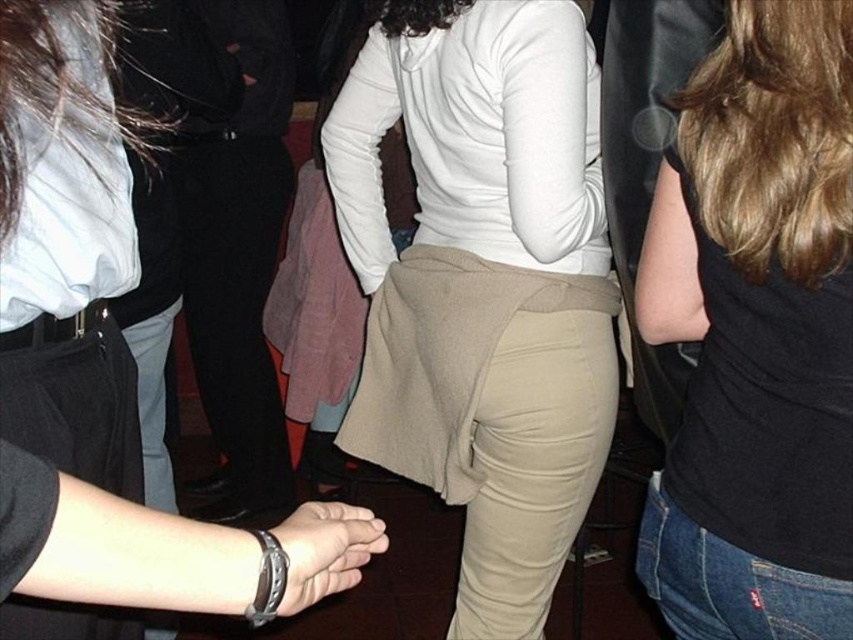
You are at a party and want to locate the black matte tank top at upper right and the leather wristwatch at center. Which one is positioned more to the right side of the scene?

The black matte tank top at upper right is positioned to the right of the leather wristwatch at center, so the black matte tank top at upper right is more to the right side of the scene.

You are at a party and see the khaki fabric pants at center and the black matte tank top at upper right. Which one is closer to the right side of the image?

The black matte tank top at upper right is closer to the right side of the image because it is positioned to the right of the khaki fabric pants at center.